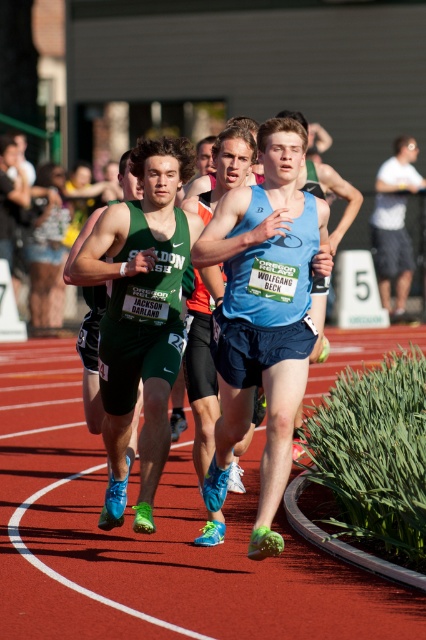
Who is lower down, blue matte tank top at center or white cotton shirt at right?

blue matte tank top at center is below.

Between blue matte tank top at center and white cotton shirt at right, which one has more height?

With more height is white cotton shirt at right.

Measure the distance between blue matte tank top at center and camera.

blue matte tank top at center is 6.21 meters from camera.

I want to click on blue matte tank top at center, so click(x=264, y=314).

Who is more forward, (x=273, y=346) or (x=126, y=232)?

Point (x=273, y=346) is in front.

Which is above, blue matte tank top at center or green matte shorts at center?

Positioned higher is green matte shorts at center.

Does point (233, 189) come farther from viewer compared to point (166, 268)?

No, (233, 189) is closer to viewer.

I want to click on blue matte tank top at center, so click(264, 314).

Between red rubber track at center and green matte shorts at center, which one appears on the right side from the viewer's perspective?

From the viewer's perspective, red rubber track at center appears more on the right side.

Is point (367, 593) positioned behind point (120, 484)?

No.

Between point (16, 634) and point (155, 294), which one is positioned in front?

Point (16, 634)

Identify the location of red rubber track at center. (152, 540).